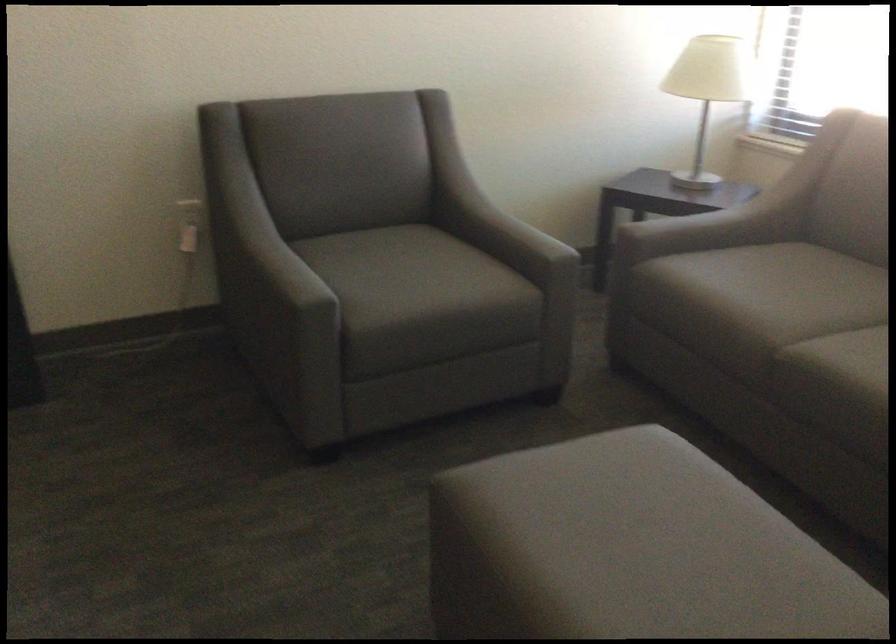
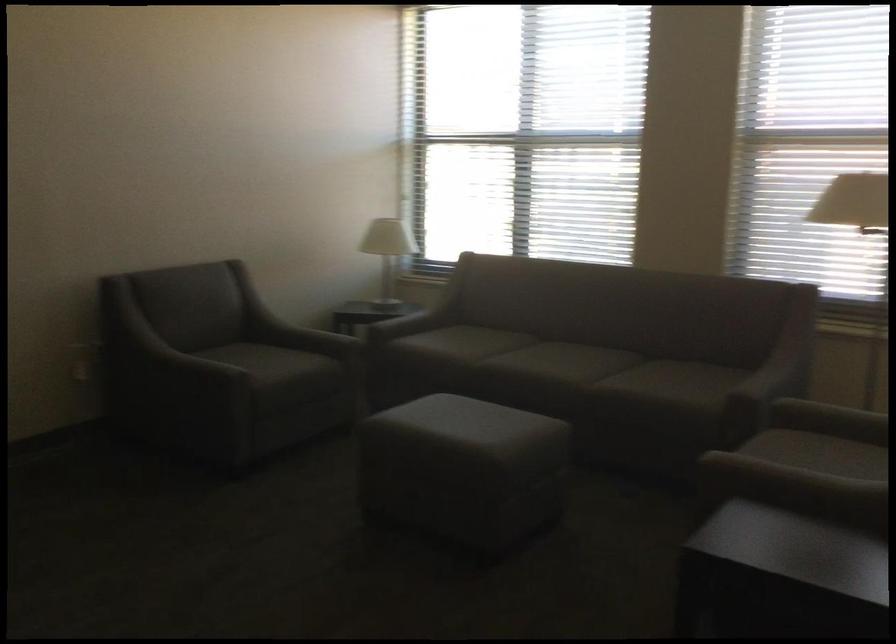
Find the pixel in the second image that matches (x=277, y=283) in the first image.

(197, 368)